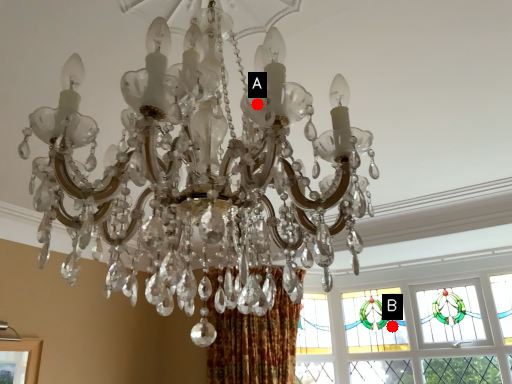
Question: Two points are circled on the image, labeled by A and B beside each circle. Which point is farther to the camera?

Choices:
 (A) A is further
 (B) B is further

Answer: (B)